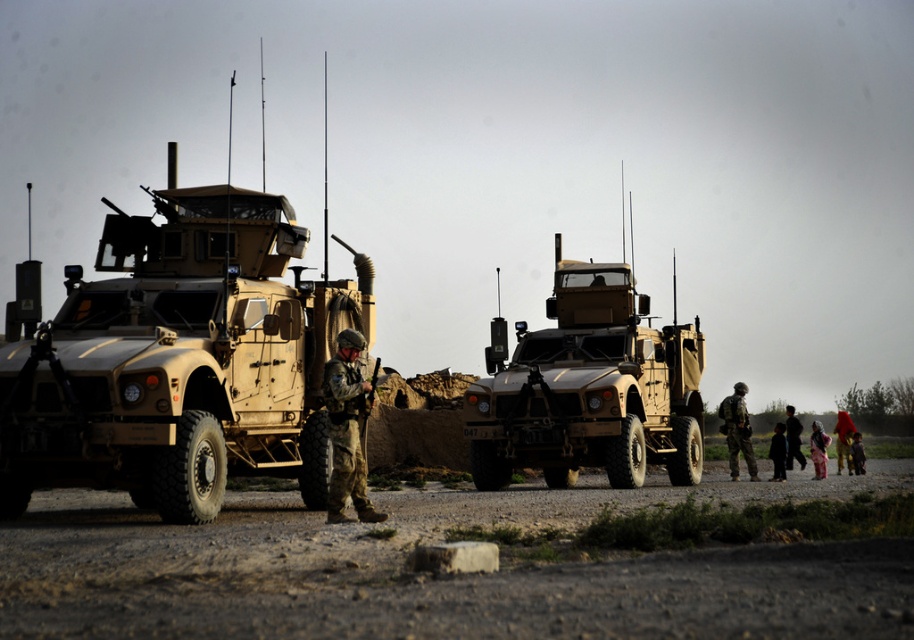
You are a photographer setting up a shot of the military vehicles in the foreground. You notice a pink fabric dress at lower right and dark clothing at right. Which item is positioned lower in the frame?

The pink fabric dress at lower right is located below dark clothing at right, so it is positioned lower in the frame.

In the military scene with two armored vehicles in a semi arid environment, you are a photographer trying to capture a shot of the dark clothing at right and the red fabric dress at lower right. Which object is wider when viewed from your position?

The dark clothing at right might be wider than red fabric dress at lower right.